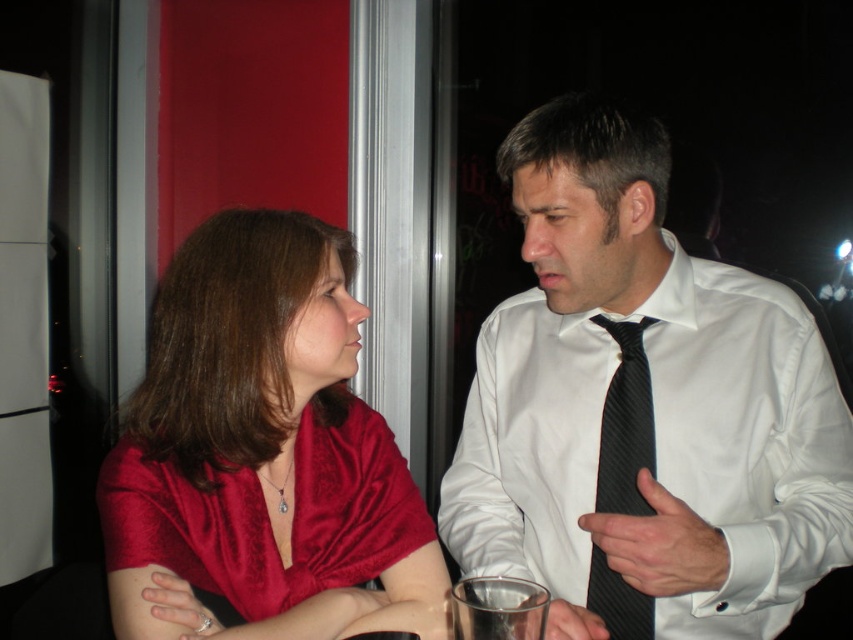
Question: Estimate the real-world distances between objects in this image. Which object is farther from the white satin shirt at center?

Choices:
 (A) clear glass at lower center
 (B) black striped tie at right

Answer: (A)

Question: Which point is farther to the camera?

Choices:
 (A) (183, 508)
 (B) (473, 588)
 (C) (814, 323)

Answer: (C)

Question: Observing the image, what is the correct spatial positioning of white satin shirt at center in reference to black striped tie at right?

Choices:
 (A) above
 (B) below

Answer: (A)

Question: Estimate the real-world distances between objects in this image. Which object is closer to the white satin shirt at center?

Choices:
 (A) satin red blouse at center
 (B) black striped tie at right

Answer: (B)

Question: Does white satin shirt at center appear on the right side of clear glass at lower center?

Choices:
 (A) yes
 (B) no

Answer: (A)

Question: Is white satin shirt at center above black striped tie at right?

Choices:
 (A) yes
 (B) no

Answer: (A)